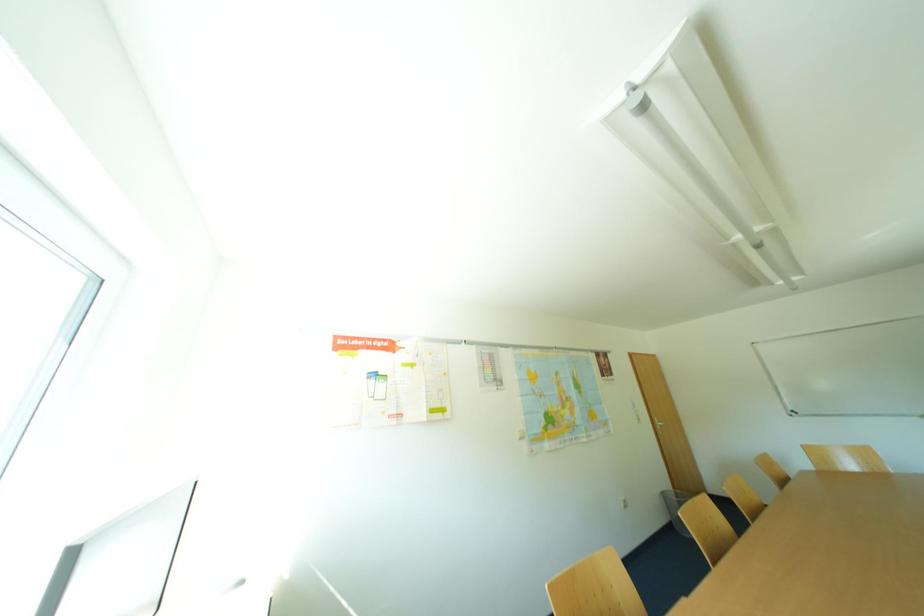
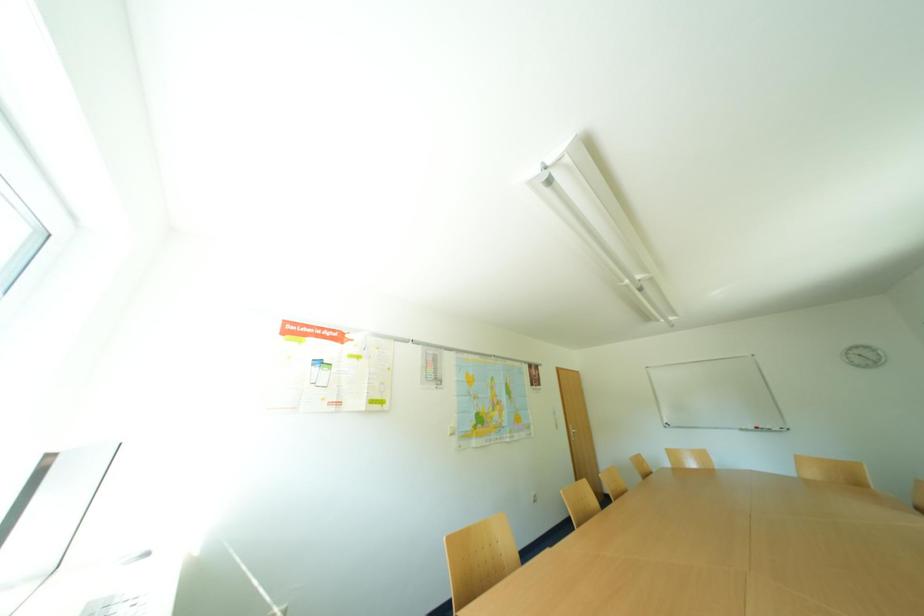
Question: The images are taken continuously from a first-person perspective. In which direction are you moving?

Choices:
 (A) Left
 (B) Right
 (C) Forward
 (D) Backward

Answer: (D)